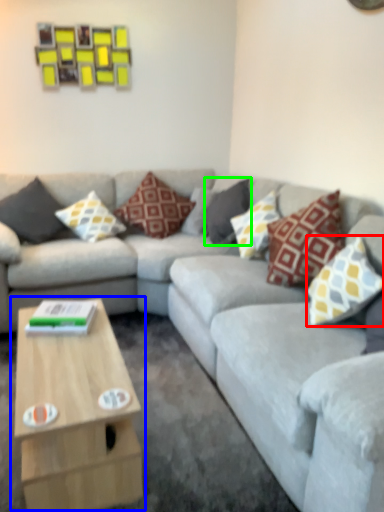
Question: Which is nearer to the pillow (highlighted by a red box)? coffee table (highlighted by a blue box) or pillow (highlighted by a green box).

Choices:
 (A) coffee table
 (B) pillow

Answer: (A)